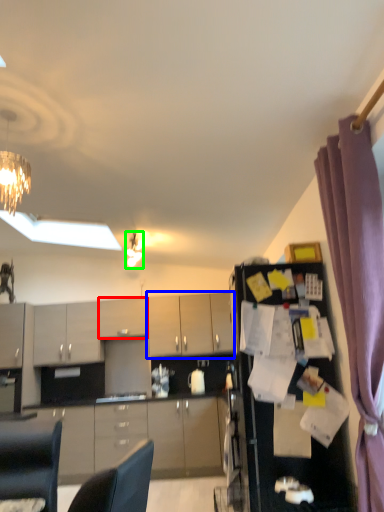
Question: Which object is positioned closest to cabinetry (highlighted by a red box)? Select from cabinetry (highlighted by a blue box) and light fixture (highlighted by a green box).

Choices:
 (A) cabinetry
 (B) light fixture

Answer: (A)